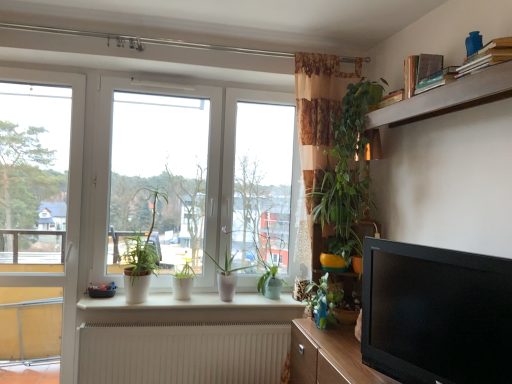
Question: Can you confirm if white glossy window at center is shorter than green matte plant at center, which ranks as the fourth houseplant in right-to-left order?

Choices:
 (A) yes
 (B) no

Answer: (B)

Question: Is white glossy window at center directly adjacent to green matte plant at center, which ranks as the fourth houseplant in right-to-left order?

Choices:
 (A) yes
 (B) no

Answer: (B)

Question: Does white glossy window at center have a greater width compared to green matte plant at center, the 2th houseplant from the left?

Choices:
 (A) no
 (B) yes

Answer: (B)

Question: Is white glossy window at center taller than green matte plant at center, the 2th houseplant from the left?

Choices:
 (A) no
 (B) yes

Answer: (B)

Question: Is white glossy window at center not near green matte plant at center, the 2th houseplant from the left?

Choices:
 (A) yes
 (B) no

Answer: (B)

Question: Does white glossy window at center come in front of green matte plant at center, which ranks as the fourth houseplant in right-to-left order?

Choices:
 (A) yes
 (B) no

Answer: (A)

Question: Does beige textured radiator at lower center have a smaller size compared to blue glossy houseplant at lower center, which is the second houseplant from right to left?

Choices:
 (A) yes
 (B) no

Answer: (B)

Question: From a real-world perspective, is beige textured radiator at lower center physically above blue glossy houseplant at lower center, which is the fourth houseplant from left to right?

Choices:
 (A) yes
 (B) no

Answer: (B)

Question: Is there a large distance between beige textured radiator at lower center and blue glossy houseplant at lower center, which is the second houseplant from right to left?

Choices:
 (A) yes
 (B) no

Answer: (B)

Question: Is the position of beige textured radiator at lower center less distant than that of blue glossy houseplant at lower center, which is the second houseplant from right to left?

Choices:
 (A) yes
 (B) no

Answer: (B)

Question: From a real-world perspective, is beige textured radiator at lower center located beneath blue glossy houseplant at lower center, which is the second houseplant from right to left?

Choices:
 (A) yes
 (B) no

Answer: (A)

Question: From the image's perspective, is beige textured radiator at lower center below blue glossy houseplant at lower center, which is the fourth houseplant from left to right?

Choices:
 (A) no
 (B) yes

Answer: (B)

Question: Is white glossy window at center not near green matte plant at center, marked as the 5th houseplant in a right-to-left arrangement?

Choices:
 (A) no
 (B) yes

Answer: (A)